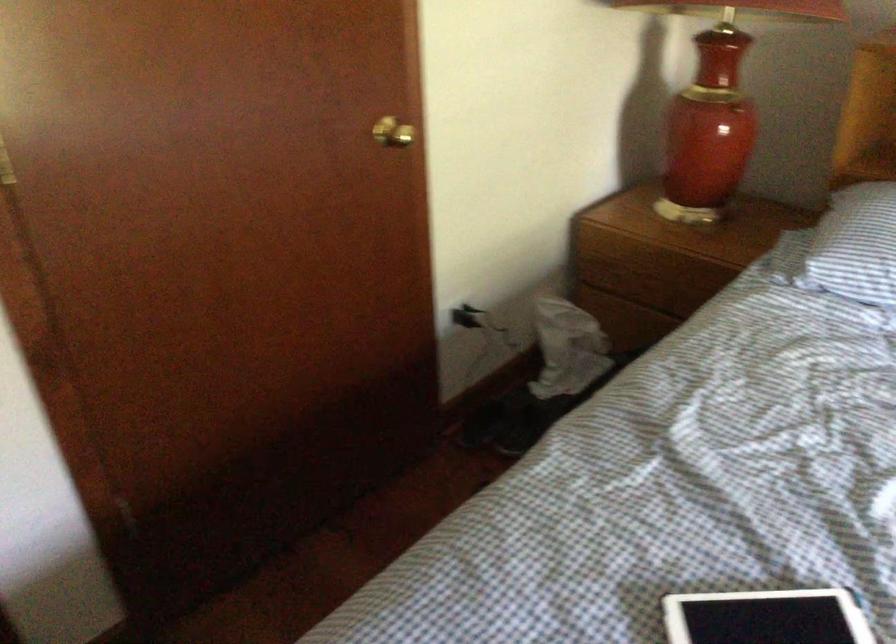
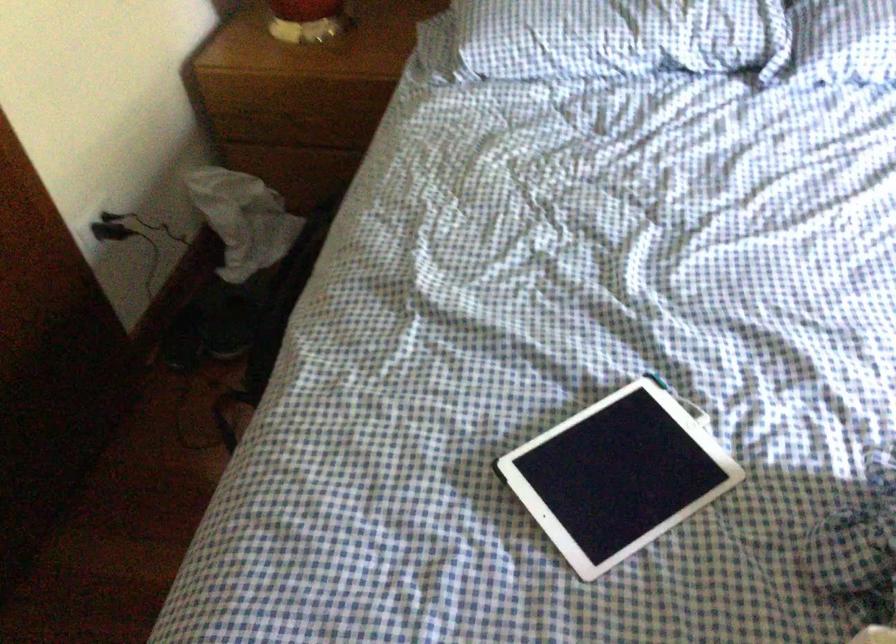
Consider the image. How did the camera likely rotate?

The camera rotated toward right-down.